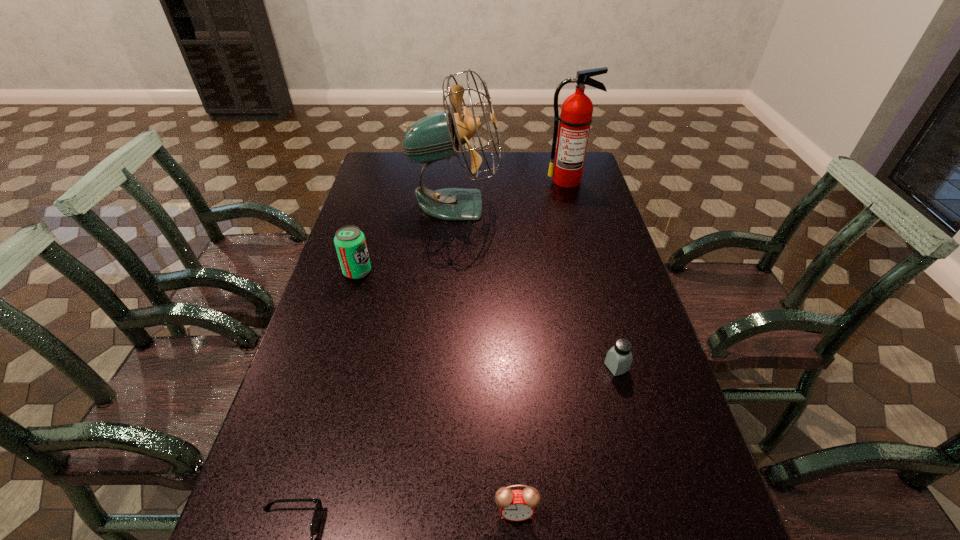
Find the location of `vacant area that lies between the fourth nearest object and the saltshaker`. vacant area that lies between the fourth nearest object and the saltshaker is located at coordinates (487, 320).

Identify the location of unoccupied area between the pop soda and the fan. (406, 238).

Image resolution: width=960 pixels, height=540 pixels. Find the location of `free space that is in between the pop soda and the alarm clock`. free space that is in between the pop soda and the alarm clock is located at coordinates (437, 392).

Find the location of a particular element. vacant area between the alarm clock and the fourth shortest object is located at coordinates (437, 392).

Find the location of a particular element. vacant space in between the fourth farthest object and the alarm clock is located at coordinates point(566,439).

Identify the location of free space between the alarm clock and the third tallest object. This screenshot has width=960, height=540. [x=437, y=392].

Locate an element on the screen. the closest object relative to the alarm clock is located at coordinates (318, 509).

Select which object appears as the third closest to the fan. Please provide its 2D coordinates. Your answer should be formatted as a tuple, i.e. [(x, y)], where the tuple contains the x and y coordinates of a point satisfying the conditions above.

[(619, 358)]

I want to click on free space that satisfies the following two spatial constraints: 1. on the back side of the third nearest object; 2. on the front-facing side of the fan for air flow, so click(572, 205).

Locate an element on the screen. The height and width of the screenshot is (540, 960). free location that satisfies the following two spatial constraints: 1. on the side of the fire extinguisher near the handle; 2. on the front-facing side of the fourth shortest object is located at coordinates (592, 272).